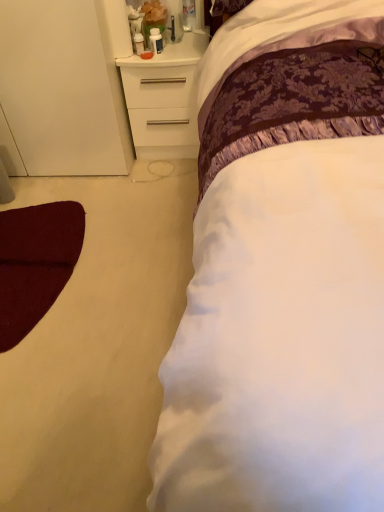
Question: Should I look upward or downward to see white satin bed at center?

Choices:
 (A) up
 (B) down

Answer: (A)

Question: From a real-world perspective, is white matte chest of drawers at upper left located beneath white satin bed at center?

Choices:
 (A) no
 (B) yes

Answer: (B)

Question: Is white matte chest of drawers at upper left outside of white satin bed at center?

Choices:
 (A) yes
 (B) no

Answer: (A)

Question: Does white matte chest of drawers at upper left lie behind white satin bed at center?

Choices:
 (A) yes
 (B) no

Answer: (A)

Question: Is white matte chest of drawers at upper left shorter than white satin bed at center?

Choices:
 (A) no
 (B) yes

Answer: (B)

Question: From the image's perspective, is white matte chest of drawers at upper left on white satin bed at center?

Choices:
 (A) no
 (B) yes

Answer: (B)

Question: Is the position of white matte chest of drawers at upper left less distant than that of white satin bed at center?

Choices:
 (A) no
 (B) yes

Answer: (A)

Question: Could you tell me if white satin bed at center is turned towards white matte chest of drawers at upper left?

Choices:
 (A) no
 (B) yes

Answer: (A)

Question: From a real-world perspective, is white satin bed at center positioned under white matte chest of drawers at upper left based on gravity?

Choices:
 (A) yes
 (B) no

Answer: (B)

Question: Does white satin bed at center appear on the right side of white matte chest of drawers at upper left?

Choices:
 (A) no
 (B) yes

Answer: (B)

Question: Is white satin bed at center closer to the viewer compared to white matte chest of drawers at upper left?

Choices:
 (A) yes
 (B) no

Answer: (A)

Question: Is the surface of white satin bed at center in direct contact with white matte chest of drawers at upper left?

Choices:
 (A) yes
 (B) no

Answer: (B)

Question: Considering the relative positions of white satin bed at center and white matte chest of drawers at upper left in the image provided, is white satin bed at center to the left of white matte chest of drawers at upper left from the viewer's perspective?

Choices:
 (A) no
 (B) yes

Answer: (A)

Question: Which is correct: white matte chest of drawers at upper left is inside white satin bed at center, or outside of it?

Choices:
 (A) outside
 (B) inside

Answer: (A)